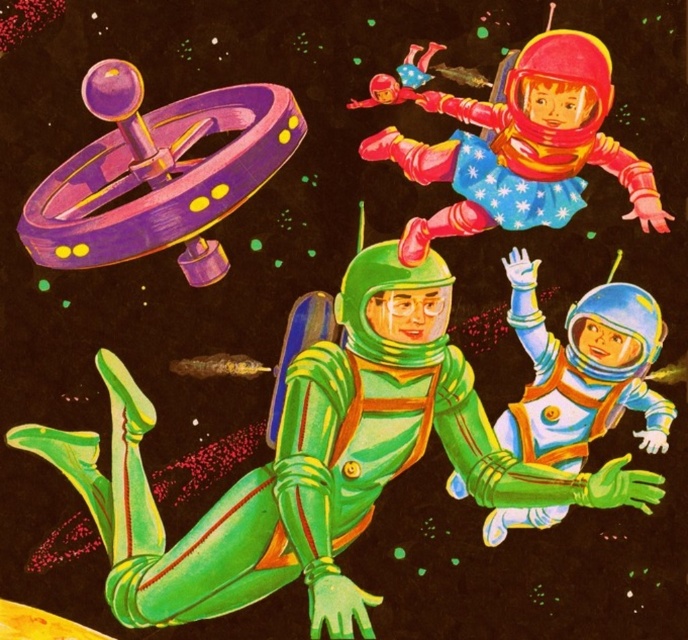
Question: Can you confirm if purple glossy spinner at upper left is positioned to the right of shiny plastic astronaut at upper center?

Choices:
 (A) yes
 (B) no

Answer: (B)

Question: Estimate the real-world distances between objects in this image. Which object is farther from the shiny blue spacesuit at lower right?

Choices:
 (A) purple glossy spinner at upper left
 (B) shiny plastic astronaut at upper center

Answer: (A)

Question: Which point is farther to the camera?

Choices:
 (A) shiny plastic astronaut at upper center
 (B) purple glossy spinner at upper left

Answer: (A)

Question: Is purple glossy spinner at upper left thinner than shiny plastic astronaut at upper center?

Choices:
 (A) no
 (B) yes

Answer: (B)

Question: Which point is closer to the camera?

Choices:
 (A) shiny blue spacesuit at lower right
 (B) shiny plastic astronaut at upper center

Answer: (B)

Question: Can you confirm if purple glossy spinner at upper left is positioned to the left of shiny blue spacesuit at lower right?

Choices:
 (A) no
 (B) yes

Answer: (B)